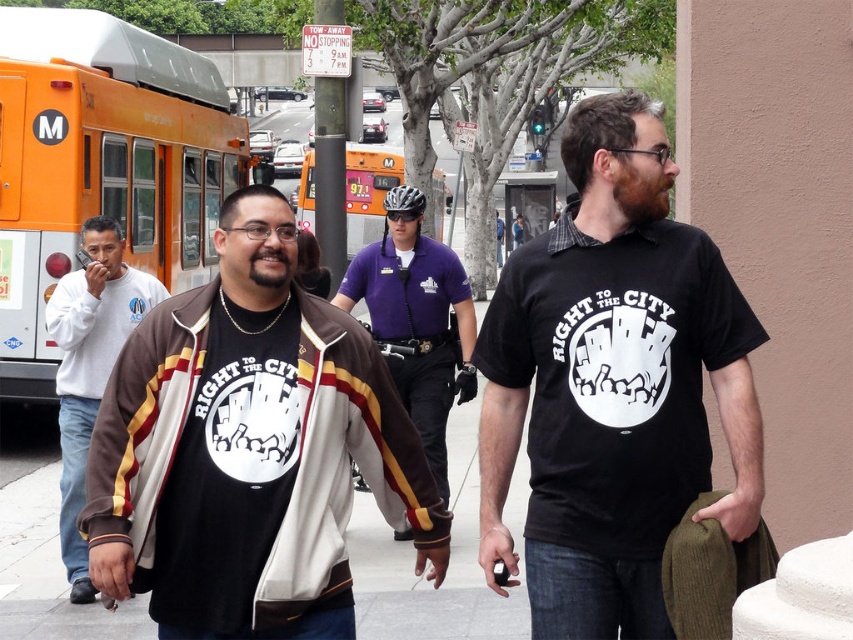
Is brown suede jacket at center below orange metallic bus at center?

Indeed, brown suede jacket at center is positioned under orange metallic bus at center.

Does brown suede jacket at center have a lesser width compared to orange metallic bus at center?

Yes, brown suede jacket at center is thinner than orange metallic bus at center.

Is point (291, 216) farther from camera compared to point (312, 193)?

No, it is in front of (312, 193).

Where is `brown suede jacket at center`? This screenshot has height=640, width=853. brown suede jacket at center is located at coordinates (248, 449).

Is black cotton t-shirt at center above purple uniform shirt at center?

Yes.

Is black cotton t-shirt at center shorter than purple uniform shirt at center?

Yes.

Is point (558, 244) less distant than point (403, 380)?

Yes, point (558, 244) is in front of point (403, 380).

Locate an element on the screen. black cotton t-shirt at center is located at coordinates (613, 385).

The width and height of the screenshot is (853, 640). What are the coordinates of `orange metallic bus at left` in the screenshot? It's located at (102, 164).

Who is more distant from viewer, (x=143, y=268) or (x=393, y=308)?

Positioned behind is point (x=143, y=268).

Is point (33, 180) positioned after point (422, 284)?

Yes, it is.

In order to click on orange metallic bus at left in this screenshot , I will do `click(102, 164)`.